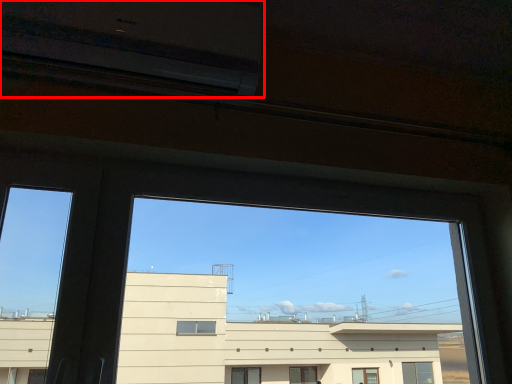
Question: Where is air conditioning (annotated by the red box) located in relation to train window in the image?

Choices:
 (A) left
 (B) right

Answer: (A)